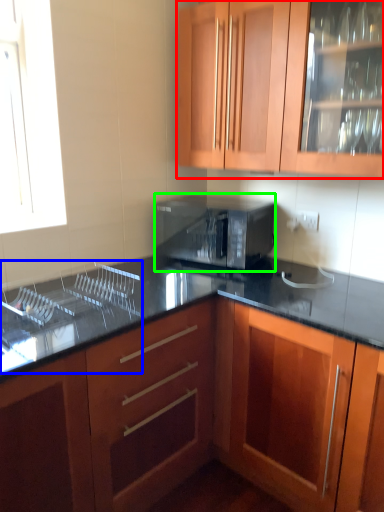
Question: Which object is the farthest from cabinetry (highlighted by a red box)? Choose among these: sink (highlighted by a blue box) or microwave oven (highlighted by a green box).

Choices:
 (A) sink
 (B) microwave oven

Answer: (A)